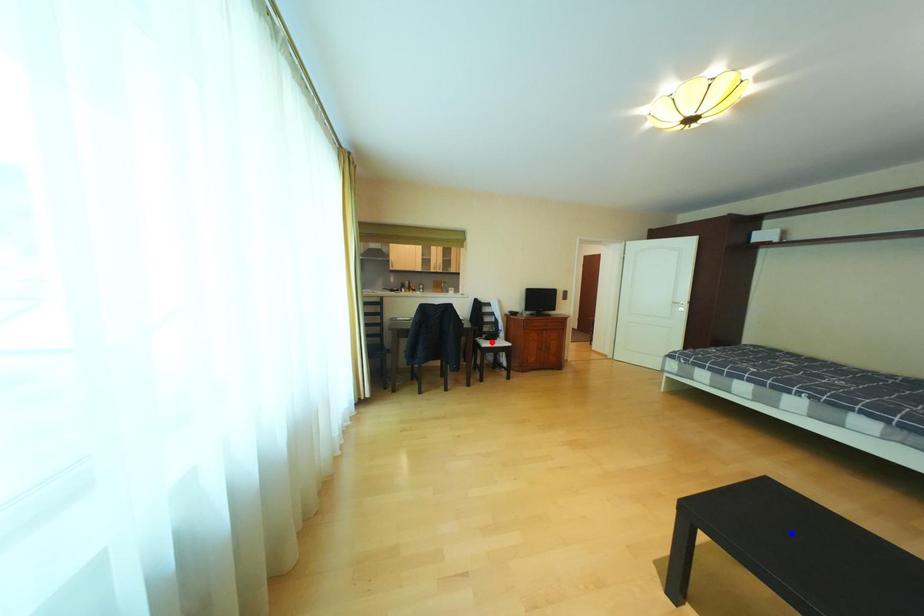
Question: Which of the two points in the image is closer to the camera?

Choices:
 (A) Blue point is closer.
 (B) Red point is closer.

Answer: (A)